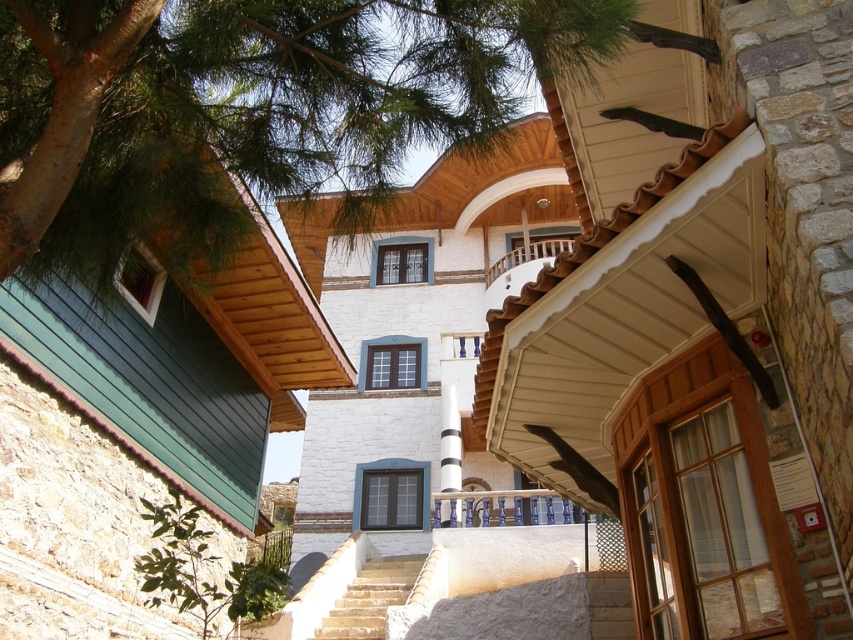
Question: Is green leafy tree at lower left thinner than smooth stone stairs at lower center?

Choices:
 (A) no
 (B) yes

Answer: (A)

Question: Which point is farther from the camera taking this photo?

Choices:
 (A) (604, 586)
 (B) (548, 522)

Answer: (B)

Question: Does green leafy tree at upper left appear on the left side of green leafy tree at lower left?

Choices:
 (A) no
 (B) yes

Answer: (A)

Question: Is light beige stone stairs at lower center above brown wooden balustrade at upper center?

Choices:
 (A) no
 (B) yes

Answer: (A)

Question: Which point is farther to the camera?

Choices:
 (A) [634, 637]
 (B) [405, 588]
 (C) [515, 259]
 (D) [277, 600]

Answer: (C)

Question: Which object appears farthest from the camera in this image?

Choices:
 (A) brown wooden balustrade at upper center
 (B) green leafy tree at lower left

Answer: (A)